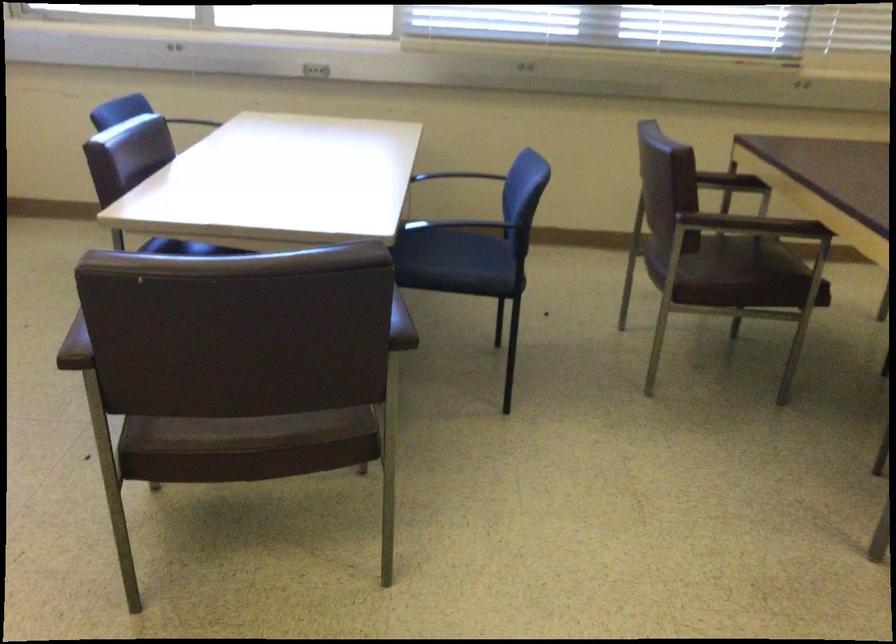
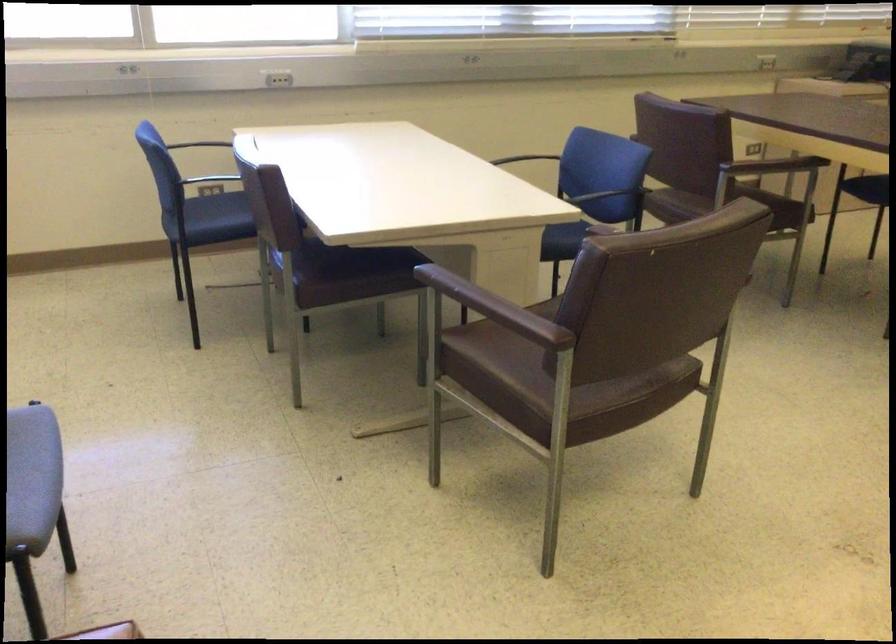
Question: I am providing you with two images of the same scene from different viewpoints. Please identify which objects are invisible in image2.

Choices:
 (A) white slip-on shoe
 (B) black chair armrest
 (C) blue chair sitting surface
 (D) brown chair armrest

Answer: (D)